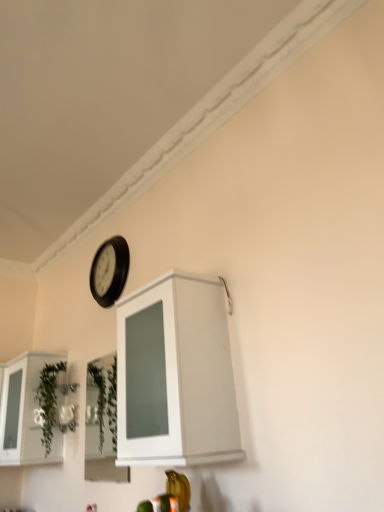
What do you see at coordinates (48, 400) in the screenshot? Image resolution: width=384 pixels, height=512 pixels. I see `green leafy plant at lower left` at bounding box center [48, 400].

Locate an element on the screen. The image size is (384, 512). white glossy cabinet at upper center, positioned as the 2th cabinetry in back-to-front order is located at coordinates (178, 376).

Identify the location of black plastic clock at upper center. The height and width of the screenshot is (512, 384). (109, 271).

Is black plastic clock at upper center taller or shorter than white glossy cabinet at upper center, which is counted as the 1th cabinetry, starting from the right?

Clearly, black plastic clock at upper center is shorter compared to white glossy cabinet at upper center, which is counted as the 1th cabinetry, starting from the right.

Considering the relative sizes of black plastic clock at upper center and white glossy cabinet at upper center, which is counted as the 1th cabinetry, starting from the right, in the image provided, is black plastic clock at upper center thinner than white glossy cabinet at upper center, which is counted as the 1th cabinetry, starting from the right,?

Correct, the width of black plastic clock at upper center is less than that of white glossy cabinet at upper center, which is counted as the 1th cabinetry, starting from the right.

Does black plastic clock at upper center have a smaller size compared to white glossy cabinet at upper center, the second cabinetry in the left-to-right sequence?

Yes, black plastic clock at upper center is smaller than white glossy cabinet at upper center, the second cabinetry in the left-to-right sequence.

Locate an element on the screen. The width and height of the screenshot is (384, 512). the 1st cabinetry directly beneath the black plastic clock at upper center (from a real-world perspective) is located at coordinates (178, 376).

Measure the distance from white glossy cabinet at upper center, which is counted as the 1th cabinetry, starting from the right, to green leafy plant at lower left.

white glossy cabinet at upper center, which is counted as the 1th cabinetry, starting from the right, is 4.85 feet from green leafy plant at lower left.

From a real-world perspective, which object rests below the other?

white glossy cabinet at upper center, which is counted as the 1th cabinetry, starting from the right.

Is white glossy cabinet at upper center, positioned as the 2th cabinetry in back-to-front order, situated inside green leafy plant at lower left or outside?

white glossy cabinet at upper center, positioned as the 2th cabinetry in back-to-front order, is outside green leafy plant at lower left.

Is point (119, 307) less distant than point (41, 399)?

Yes.

How many degrees apart are the facing directions of green leafy plant at lower left and black plastic clock at upper center?

0.000303 degrees.

Identify the location of plant below the black plastic clock at upper center (from a real-world perspective). This screenshot has width=384, height=512. click(48, 400).

Is green leafy plant at lower left oriented towards black plastic clock at upper center?

No, green leafy plant at lower left is not aimed at black plastic clock at upper center.

Between green leafy plant at lower left and black plastic clock at upper center, which one has smaller width?

black plastic clock at upper center is thinner.

Between point (154, 386) and point (55, 452), which one is positioned behind?

The point (55, 452) is behind.

How far apart are white glossy cabinet at upper center, which is counted as the 1th cabinetry, starting from the right, and white glossy cabinet at left, which appears as the second cabinetry when viewed from the front?

They are 1.55 meters apart.

Is white glossy cabinet at upper center, acting as the first cabinetry starting from the front, positioned with its back to white glossy cabinet at left, the first cabinetry viewed from the back?

white glossy cabinet at upper center, acting as the first cabinetry starting from the front, is not turned away from white glossy cabinet at left, the first cabinetry viewed from the back.

Where is `cabinetry located on the left of white glossy cabinet at upper center, which is counted as the 1th cabinetry, starting from the right`? This screenshot has height=512, width=384. cabinetry located on the left of white glossy cabinet at upper center, which is counted as the 1th cabinetry, starting from the right is located at coordinates click(25, 412).

In the scene shown: Is white glossy cabinet at left, which appears as the second cabinetry when viewed from the front, facing away from white glossy cabinet at upper center, acting as the first cabinetry starting from the front?

No, white glossy cabinet at left, which appears as the second cabinetry when viewed from the front,'s orientation is not away from white glossy cabinet at upper center, acting as the first cabinetry starting from the front.

From the image's perspective, does white glossy cabinet at left, which appears as the second cabinetry when viewed from the front, appear lower than white glossy cabinet at upper center, acting as the first cabinetry starting from the front?

Indeed, from the image's perspective, white glossy cabinet at left, which appears as the second cabinetry when viewed from the front, is shown beneath white glossy cabinet at upper center, acting as the first cabinetry starting from the front.

Consider the image. Who is smaller, white glossy cabinet at left, the 2th cabinetry viewed from the right, or white glossy cabinet at upper center, which is counted as the 1th cabinetry, starting from the right?

Smaller between the two is white glossy cabinet at upper center, which is counted as the 1th cabinetry, starting from the right.

From a real-world perspective, is white glossy cabinet at left, which appears as the second cabinetry when viewed from the front, physically located above or below white glossy cabinet at upper center, which is counted as the 1th cabinetry, starting from the right?

From a real-world perspective, white glossy cabinet at left, which appears as the second cabinetry when viewed from the front, is physically below white glossy cabinet at upper center, which is counted as the 1th cabinetry, starting from the right.

Is black plastic clock at upper center closer to camera compared to green leafy plant at lower left?

Yes.

Find the location of `plant on the left of black plastic clock at upper center`. plant on the left of black plastic clock at upper center is located at coordinates (48, 400).

Is black plastic clock at upper center turned away from green leafy plant at lower left?

No.

Can you confirm if green leafy plant at lower left is shorter than white glossy cabinet at upper center, positioned as the 2th cabinetry in back-to-front order?

Indeed, green leafy plant at lower left has a lesser height compared to white glossy cabinet at upper center, positioned as the 2th cabinetry in back-to-front order.

Is white glossy cabinet at upper center, positioned as the 2th cabinetry in back-to-front order, inside green leafy plant at lower left?

Actually, white glossy cabinet at upper center, positioned as the 2th cabinetry in back-to-front order, is outside green leafy plant at lower left.

Find the location of a particular element. This screenshot has height=512, width=384. plant below the white glossy cabinet at upper center, the second cabinetry in the left-to-right sequence (from the image's perspective) is located at coordinates (48, 400).

Is green leafy plant at lower left directly adjacent to white glossy cabinet at upper center, positioned as the 2th cabinetry in back-to-front order?

No, green leafy plant at lower left is not touching white glossy cabinet at upper center, positioned as the 2th cabinetry in back-to-front order.

Locate an element on the screen. This screenshot has height=512, width=384. cabinetry that is the 1st object located below the black plastic clock at upper center (from the image's perspective) is located at coordinates (178, 376).

Where is `plant lying on the left of white glossy cabinet at upper center, acting as the first cabinetry starting from the front`? The image size is (384, 512). plant lying on the left of white glossy cabinet at upper center, acting as the first cabinetry starting from the front is located at coordinates (48, 400).

From the image, which object appears to be farther from white glossy cabinet at left, which appears as the second cabinetry when viewed from the front, green leafy plant at lower left or white glossy cabinet at upper center, positioned as the 2th cabinetry in back-to-front order?

white glossy cabinet at upper center, positioned as the 2th cabinetry in back-to-front order, lies further to white glossy cabinet at left, which appears as the second cabinetry when viewed from the front, than the other object.

Which object lies nearer to the anchor point black plastic clock at upper center, green leafy plant at lower left or white glossy cabinet at left, which is counted as the 1th cabinetry, starting from the left?

green leafy plant at lower left is closer to black plastic clock at upper center.

Which object lies nearer to the anchor point black plastic clock at upper center, green leafy plant at lower left or white glossy cabinet at upper center, acting as the first cabinetry starting from the front?

green leafy plant at lower left.

Based on their spatial positions, is black plastic clock at upper center or green leafy plant at lower left further from white glossy cabinet at upper center, acting as the first cabinetry starting from the front?

The object further to white glossy cabinet at upper center, acting as the first cabinetry starting from the front, is green leafy plant at lower left.

Based on their spatial positions, is green leafy plant at lower left or black plastic clock at upper center closer to white glossy cabinet at left, the first cabinetry viewed from the back?

Based on the image, green leafy plant at lower left appears to be nearer to white glossy cabinet at left, the first cabinetry viewed from the back.

Considering their positions, is white glossy cabinet at left, the 2th cabinetry viewed from the right, positioned further to black plastic clock at upper center than white glossy cabinet at upper center, positioned as the 2th cabinetry in back-to-front order?

white glossy cabinet at upper center, positioned as the 2th cabinetry in back-to-front order.

From the picture: Which object lies nearer to the anchor point white glossy cabinet at upper center, acting as the first cabinetry starting from the front, white glossy cabinet at left, which appears as the second cabinetry when viewed from the front, or green leafy plant at lower left?

green leafy plant at lower left is positioned closer to the anchor white glossy cabinet at upper center, acting as the first cabinetry starting from the front.

Looking at the image, which one is located further to white glossy cabinet at upper center, positioned as the 2th cabinetry in back-to-front order, white glossy cabinet at left, which appears as the second cabinetry when viewed from the front, or black plastic clock at upper center?

white glossy cabinet at left, which appears as the second cabinetry when viewed from the front, is positioned further to the anchor white glossy cabinet at upper center, positioned as the 2th cabinetry in back-to-front order.

This screenshot has height=512, width=384. What are the coordinates of `plant between black plastic clock at upper center and white glossy cabinet at left, the first cabinetry viewed from the back, in the vertical direction` in the screenshot? It's located at [x=48, y=400].

At what (x,y) coordinates should I click in order to perform the action: click on clock between white glossy cabinet at upper center, positioned as the 2th cabinetry in back-to-front order, and green leafy plant at lower left from front to back. Please return your answer as a coordinate pair (x, y). Looking at the image, I should click on (109, 271).

Find the location of a particular element. plant between white glossy cabinet at upper center, which is counted as the 1th cabinetry, starting from the right, and white glossy cabinet at left, which appears as the second cabinetry when viewed from the front, from front to back is located at coordinates (48, 400).

I want to click on clock between white glossy cabinet at upper center, which is counted as the 1th cabinetry, starting from the right, and white glossy cabinet at left, which is counted as the 1th cabinetry, starting from the left, from front to back, so click(109, 271).